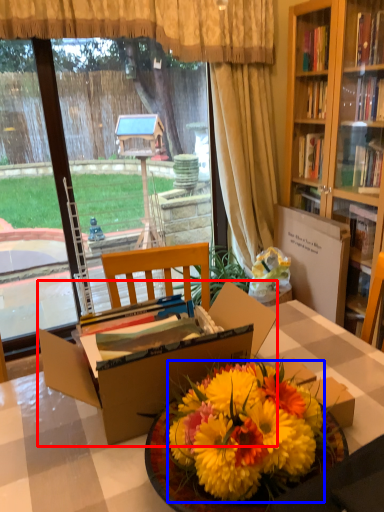
Question: Which point is further to the camera, box (highlighted by a red box) or flower (highlighted by a blue box)?

Choices:
 (A) box
 (B) flower

Answer: (A)